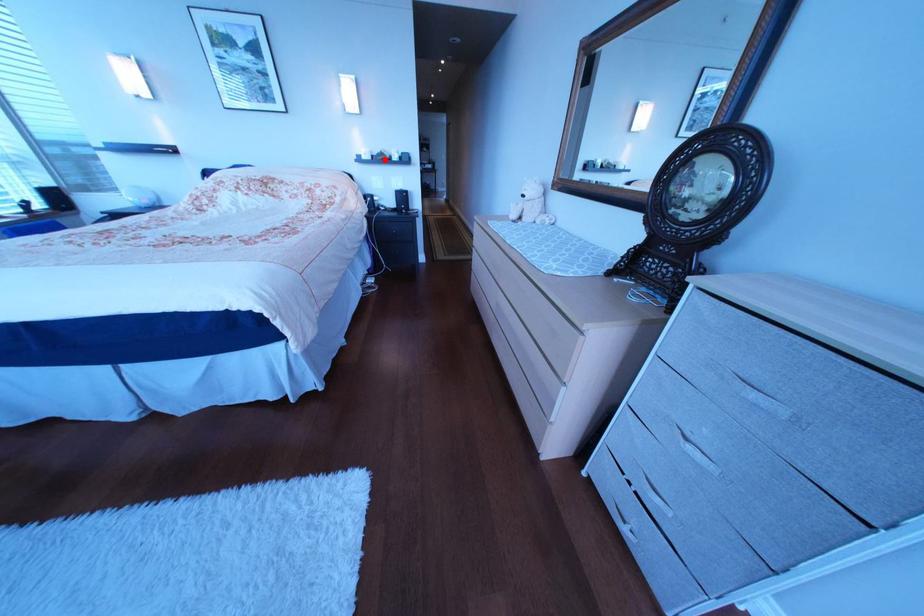
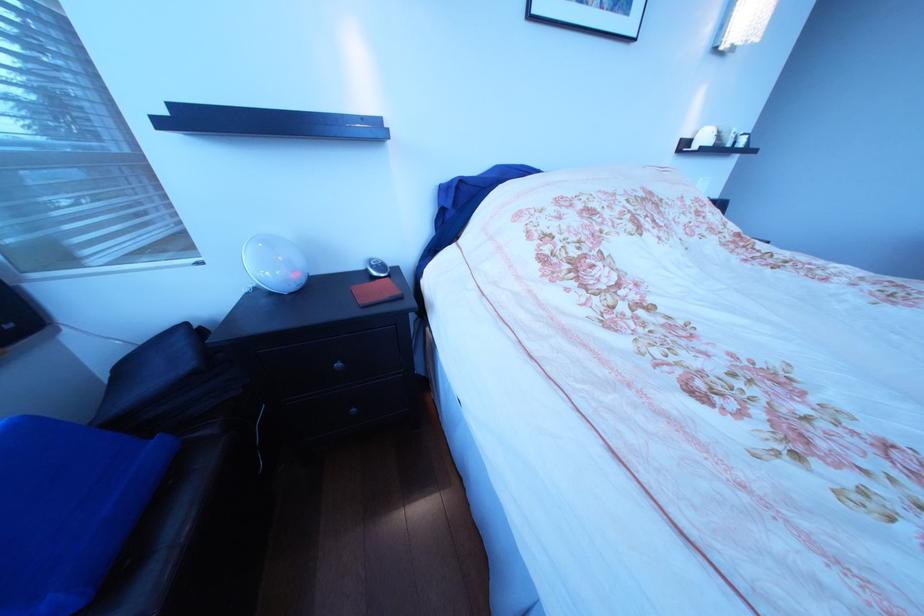
Find the pixel in the second image that matches the highlighted location in the first image.

(724, 146)